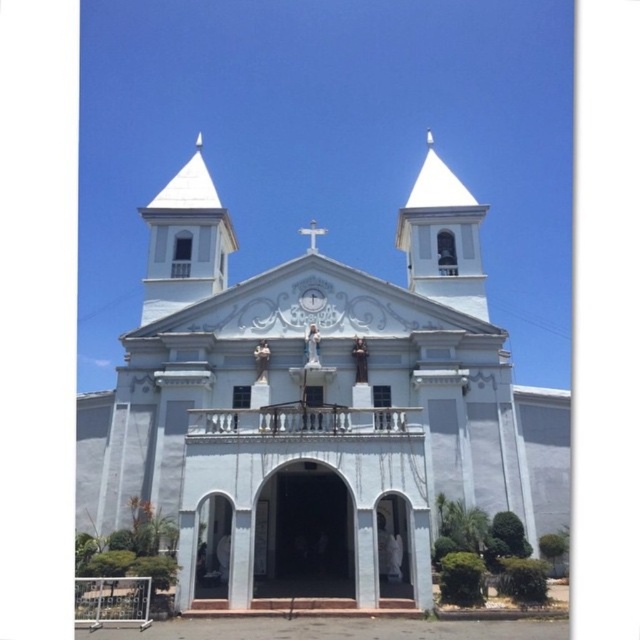
You are standing in front of the white marble church at center and want to take a photo of both it and the white marble bell tower at upper center. Which direction should you face to ensure both are visible in your camera frame?

Since the white marble church at center is to the left of the white marble bell tower at upper center, you should face towards the right side of the church to include both the white marble church at center and the white marble bell tower at upper center in your camera frame.

You are standing in front of the white church and want to know which object is taller between the white marble clock at center and the white marble cross at center. Can you determine which one is taller?

The white marble cross at center is taller than the white marble clock at center.